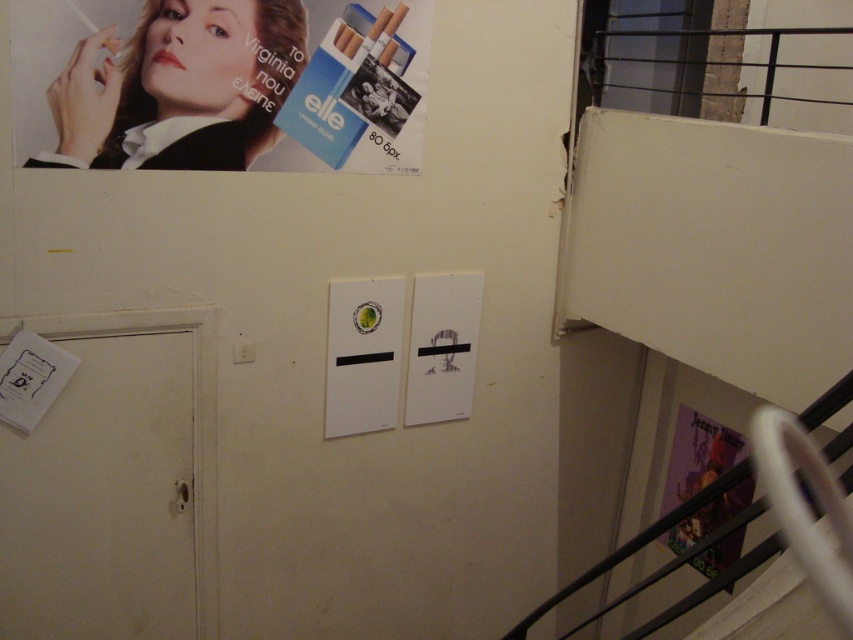
Question: Can you confirm if white matte sign at center is wider than white paper at center?

Choices:
 (A) no
 (B) yes

Answer: (A)

Question: Can you confirm if white matte sign at center is positioned below white paper at center?

Choices:
 (A) no
 (B) yes

Answer: (B)

Question: Estimate the real-world distances between objects in this image. Which object is closer to the matte black poster at upper left?

Choices:
 (A) white paper at center
 (B) white matte sign at center
 (C) purple glossy poster at lower right

Answer: (B)

Question: Which object is positioned closest to the white paper at center?

Choices:
 (A) purple glossy poster at lower right
 (B) white matte sign at center
 (C) matte black poster at upper left

Answer: (B)

Question: Which is farther from the white matte sign at center?

Choices:
 (A) white paper at center
 (B) purple glossy poster at lower right
 (C) matte black poster at upper left

Answer: (B)

Question: From the image, what is the correct spatial relationship of white matte sign at center in relation to white paper at center?

Choices:
 (A) right
 (B) left

Answer: (B)